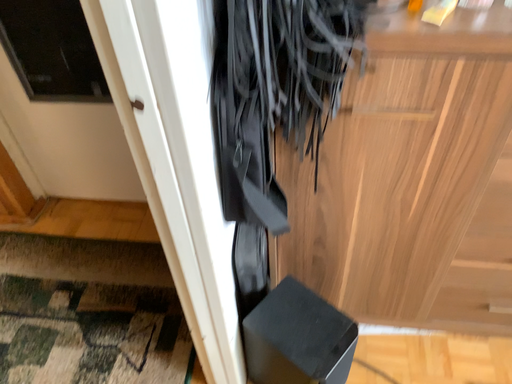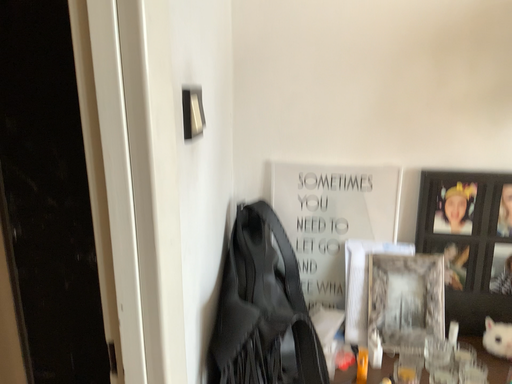
Question: How did the camera likely rotate when shooting the video?

Choices:
 (A) rotated downward
 (B) rotated upward

Answer: (B)